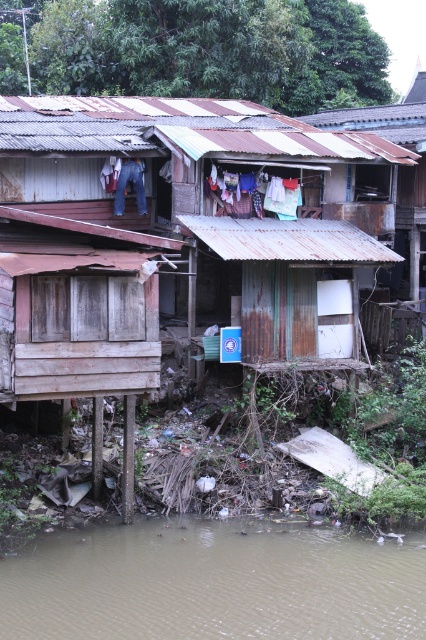
You are a photographer aiming to capture the rusty corrugated metal hut at center and the white fabric at center in a single frame. Based on their positions, which object should you adjust your camera to focus on first to ensure both are in the frame?

The rusty corrugated metal hut at center is positioned on the left side of white fabric at center, so you should focus on the rusty corrugated metal hut at center first to ensure both are included in the frame.

In the scene shown: You are a delivery person trying to reach a package left at the rusty corrugated metal hut at center. However, there is brown muddy water at lower center in your path. Based on the scene, can you safely walk directly to the hut without getting your feet wet?

The rusty corrugated metal hut at center is located above brown muddy water at lower center, so you can safely walk to the hut as the water is below it and not blocking the path.

In the scene shown: You need to cross from the left side to the right side of the image. There is brown muddy water at lower center and white fabric at center. Which path has a wider passage for you to walk through?

The white fabric at center has a wider passage than the brown muddy water at lower center, so you should choose the path through the white fabric at center.